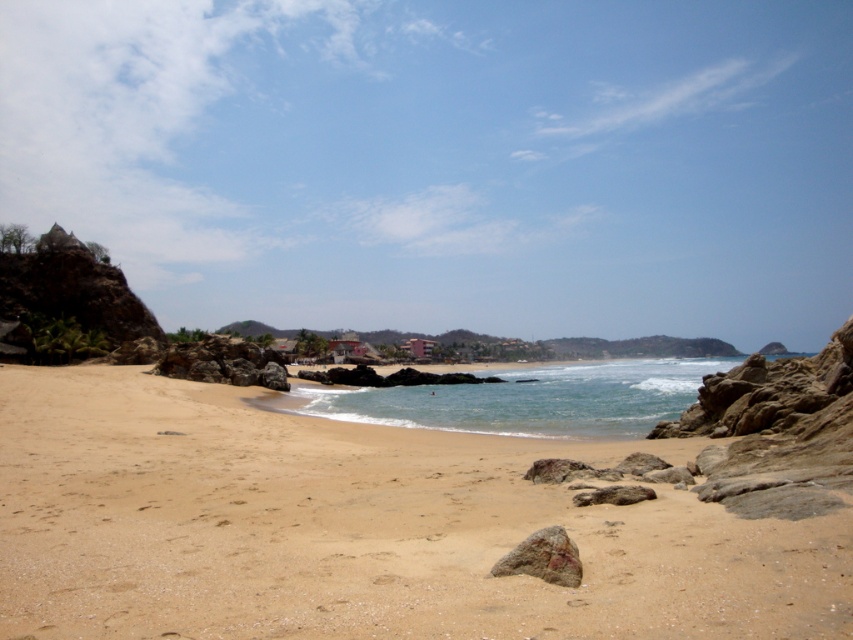
You are standing on the sandy beach at lower left and want to pick up the rusty rock at center. How many steps do you need to take to reach it?

The rusty rock at center is farther away from the viewer than the sandy beach at lower left, so you would need to take several steps forward to reach it.

You are planning to build a small sandcastle on the sandy beach at lower left and place a decorative rusty rock at center nearby. Based on the scene, which area has more space to work with?

The sandy beach at lower left might be wider than rusty rock at center, so the sandy beach at lower left likely has more space for building the sandcastle.

You are standing on the beach and looking at two points marked in the image. One is at point coordinates point (86, 547) and the other at point (546, 545). Which point is closer to you?

Point (86, 547) is further to the camera than point (546, 545), so the point closer to you is point (546, 545).